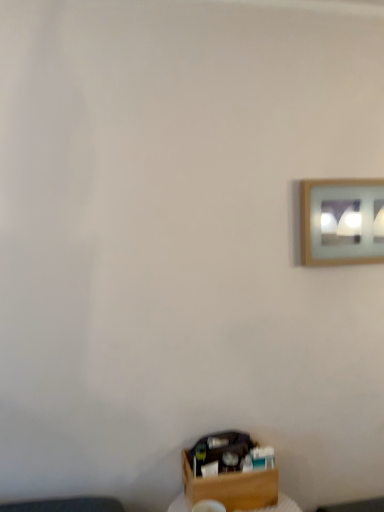
Question: Considering the relative positions of wooden box at lower center and wooden frame at upper right in the image provided, is wooden box at lower center to the left of wooden frame at upper right from the viewer's perspective?

Choices:
 (A) no
 (B) yes

Answer: (B)

Question: Considering the relative sizes of wooden box at lower center and wooden frame at upper right in the image provided, is wooden box at lower center wider than wooden frame at upper right?

Choices:
 (A) yes
 (B) no

Answer: (A)

Question: Is the position of wooden box at lower center more distant than that of wooden frame at upper right?

Choices:
 (A) yes
 (B) no

Answer: (B)

Question: Can you confirm if wooden box at lower center is shorter than wooden frame at upper right?

Choices:
 (A) yes
 (B) no

Answer: (A)

Question: Is wooden box at lower center touching wooden frame at upper right?

Choices:
 (A) yes
 (B) no

Answer: (B)

Question: From the image's perspective, is wooden box at lower center located beneath wooden frame at upper right?

Choices:
 (A) yes
 (B) no

Answer: (A)

Question: Would you consider wooden frame at upper right to be distant from wooden box at lower center?

Choices:
 (A) yes
 (B) no

Answer: (B)

Question: From the image's perspective, would you say wooden frame at upper right is positioned over wooden box at lower center?

Choices:
 (A) no
 (B) yes

Answer: (B)

Question: Does wooden frame at upper right have a lesser height compared to wooden box at lower center?

Choices:
 (A) yes
 (B) no

Answer: (B)

Question: Is wooden frame at upper right located outside wooden box at lower center?

Choices:
 (A) no
 (B) yes

Answer: (B)

Question: Is wooden frame at upper right positioned before wooden box at lower center?

Choices:
 (A) no
 (B) yes

Answer: (A)

Question: Is wooden frame at upper right wider than wooden box at lower center?

Choices:
 (A) no
 (B) yes

Answer: (A)

Question: From the image's perspective, relative to wooden box at lower center, is wooden frame at upper right above or below?

Choices:
 (A) below
 (B) above

Answer: (B)